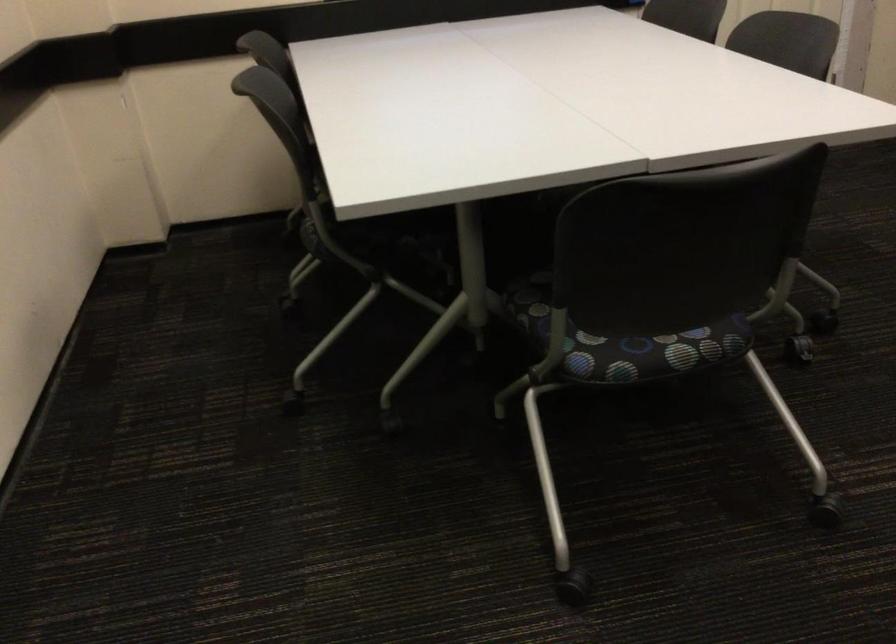
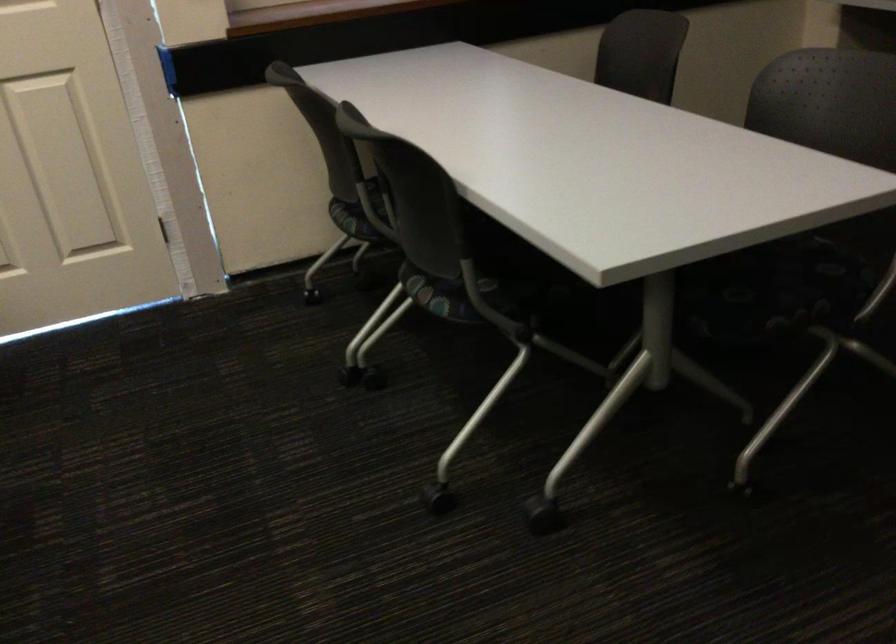
Question: Which direction would the cameraman need to move to produce the second image? Reply with the corresponding letter.

Choices:
 (A) Left
 (B) Right
 (C) Forward
 (D) Backward

Answer: (B)